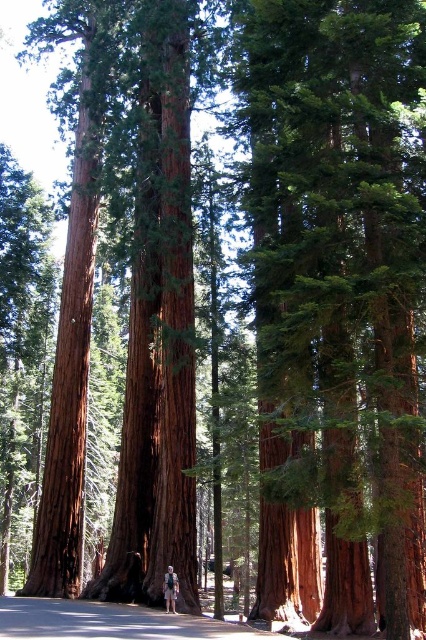
Question: Does smooth reddish-brown tree trunk at center appear over tan leather jacket at center?

Choices:
 (A) yes
 (B) no

Answer: (A)

Question: Which point is farther from the camera taking this photo?

Choices:
 (A) (175, 579)
 (B) (275, 86)

Answer: (A)

Question: Among these objects, which one is farthest from the camera?

Choices:
 (A) smooth reddish-brown tree trunk at center
 (B) tan leather jacket at center

Answer: (B)

Question: Is the position of smooth reddish-brown tree trunk at center less distant than that of tan leather jacket at center?

Choices:
 (A) yes
 (B) no

Answer: (A)

Question: Does smooth reddish-brown tree trunk at center appear on the left side of tan leather jacket at center?

Choices:
 (A) no
 (B) yes

Answer: (A)